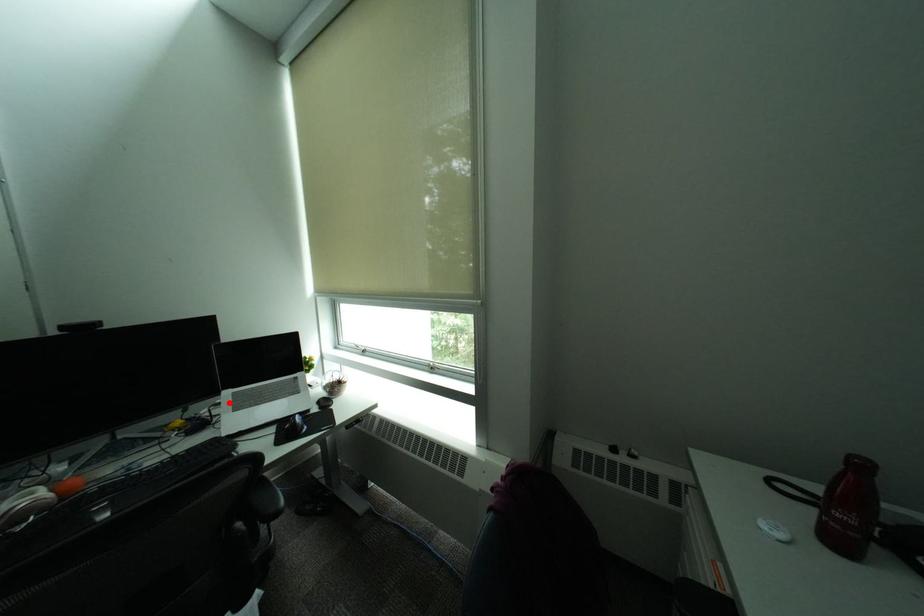
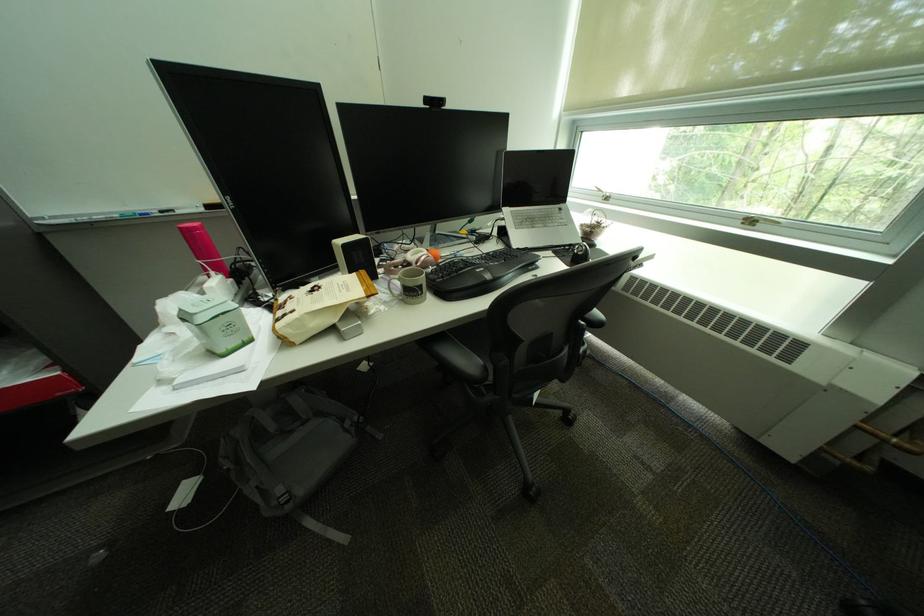
In the second image, find the point that corresponds to the highlighted location in the first image.

(514, 217)